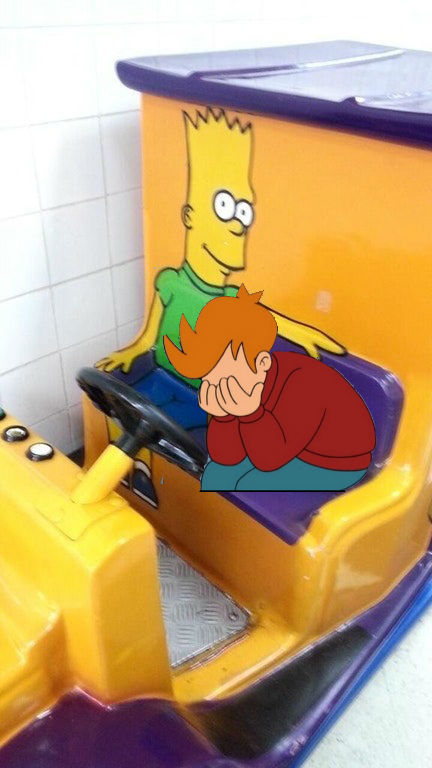
Locate an element on the screen. purple seat is located at coordinates 366,386.